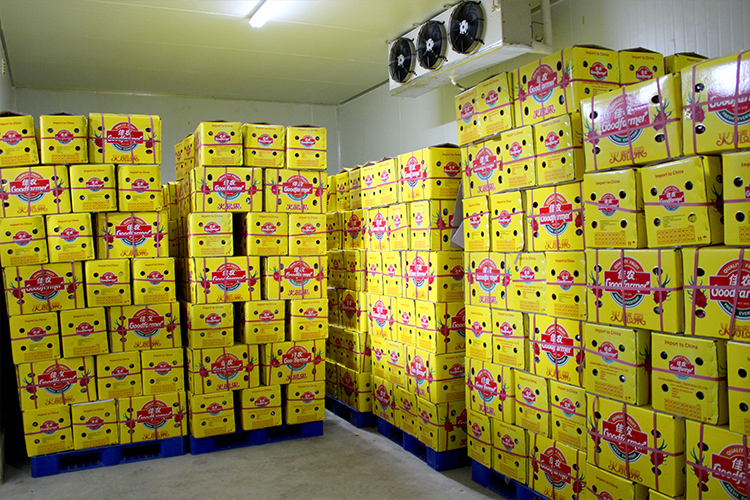
At what (x,y) coordinates should I click in order to perform the action: click on light. Please return your answer as a coordinate pair (x, y). Looking at the image, I should click on (273, 13).